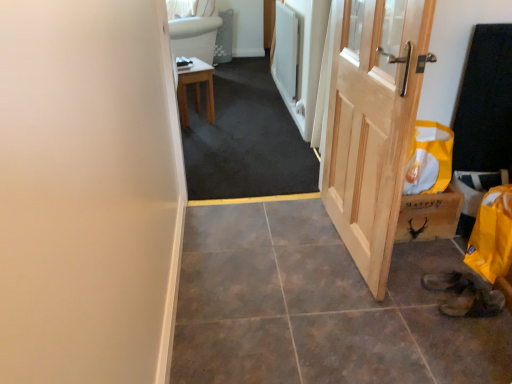
The height and width of the screenshot is (384, 512). In order to click on free space on the front side of natural wood door at right in this screenshot , I will do `click(359, 316)`.